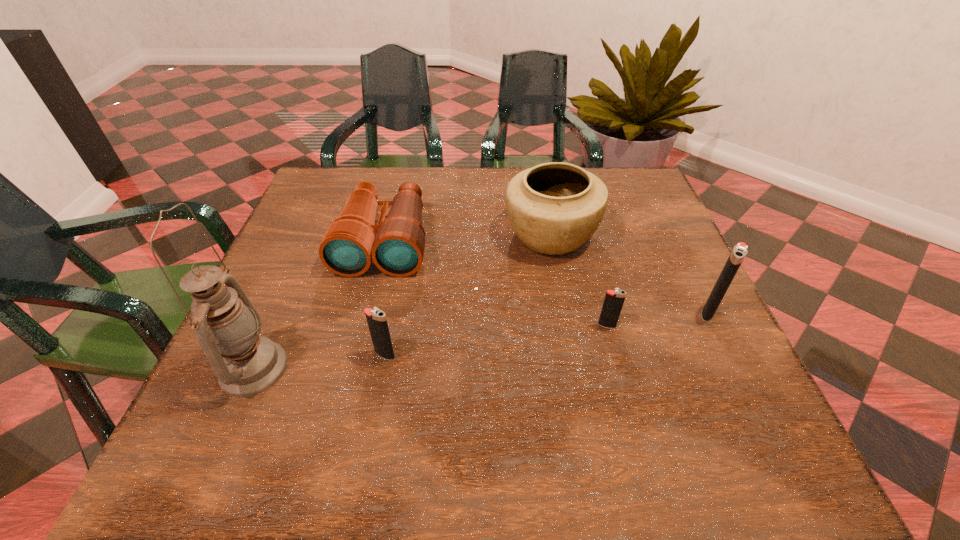
In the image, there is a desktop. Where is `vacant region at the near right corner`? Image resolution: width=960 pixels, height=540 pixels. vacant region at the near right corner is located at coordinates (651, 375).

What are the coordinates of `vacant space in between the pottery and the tallest object` in the screenshot? It's located at (402, 302).

The height and width of the screenshot is (540, 960). Identify the location of free space between the pottery and the third farthest object. (630, 274).

The image size is (960, 540). I want to click on free space that is in between the binoculars and the leftmost igniter, so click(x=385, y=298).

I want to click on vacant space that's between the pottery and the oil lamp, so click(402, 302).

Locate an element on the screen. free space between the second shortest igniter and the shortest object is located at coordinates (496, 340).

Find the location of `blank region between the leftmost object and the nearest igniter`. blank region between the leftmost object and the nearest igniter is located at coordinates (320, 362).

I want to click on free spot between the pottery and the rightmost igniter, so click(630, 274).

Image resolution: width=960 pixels, height=540 pixels. Find the location of `empty space that is in between the second shortest igniter and the leftmost object`. empty space that is in between the second shortest igniter and the leftmost object is located at coordinates (320, 362).

Locate an element on the screen. free space between the second igniter from right to left and the third farthest object is located at coordinates (658, 319).